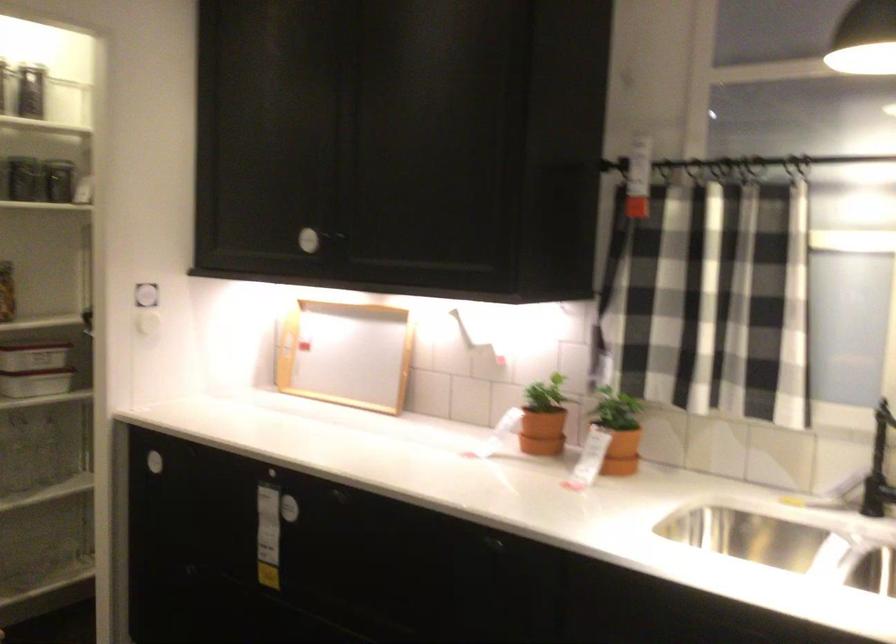
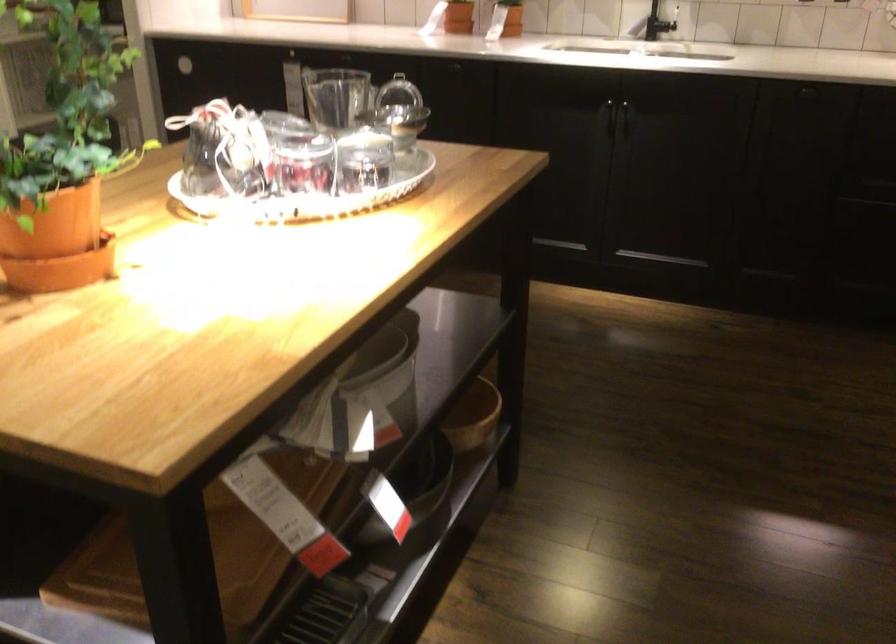
Find the pixel in the second image that matches [608,476] in the first image.

(504, 31)